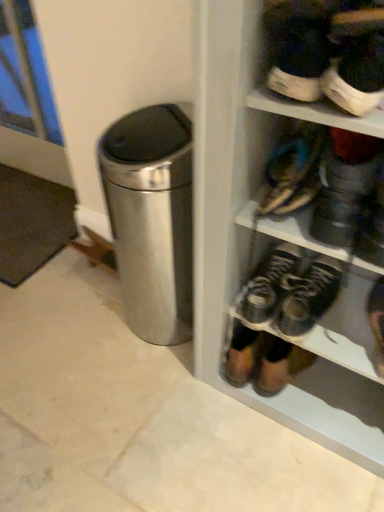
Question: Is leather sandals at upper right, which ranks as the third footwear in bottom-to-top order, beside leather shoe at lower right, the fourth footwear positioned from the top?

Choices:
 (A) yes
 (B) no

Answer: (B)

Question: Is leather sandals at upper right, which ranks as the third footwear in bottom-to-top order, positioned with its back to leather shoe at lower right, the fourth footwear positioned from the top?

Choices:
 (A) no
 (B) yes

Answer: (A)

Question: From the image's perspective, is leather sandals at upper right, which ranks as the third footwear in bottom-to-top order, under leather shoe at lower right, the fourth footwear positioned from the top?

Choices:
 (A) yes
 (B) no

Answer: (B)

Question: Does leather sandals at upper right, which ranks as the third footwear in bottom-to-top order, appear on the right side of leather shoe at lower right, the first footwear ordered from the bottom?

Choices:
 (A) no
 (B) yes

Answer: (A)

Question: From the image's perspective, would you say leather sandals at upper right, which appears as the second footwear when viewed from the top, is positioned over leather shoe at lower right, the first footwear ordered from the bottom?

Choices:
 (A) no
 (B) yes

Answer: (B)

Question: From the image's perspective, relative to leather shoe at lower right, the fourth footwear positioned from the top, is leather sandals at upper right, which appears as the second footwear when viewed from the top, above or below?

Choices:
 (A) above
 (B) below

Answer: (A)

Question: Considering the positions of leather sandals at upper right, which appears as the second footwear when viewed from the top, and leather shoe at lower right, the fourth footwear positioned from the top, in the image, is leather sandals at upper right, which appears as the second footwear when viewed from the top, taller or shorter than leather shoe at lower right, the fourth footwear positioned from the top,?

Choices:
 (A) short
 (B) tall

Answer: (A)

Question: Considering the positions of point (284, 204) and point (370, 326), is point (284, 204) closer or farther from the camera than point (370, 326)?

Choices:
 (A) farther
 (B) closer

Answer: (B)

Question: Considering their positions, is leather sandals at upper right, which appears as the second footwear when viewed from the top, located in front of or behind leather shoe at lower right, the first footwear ordered from the bottom?

Choices:
 (A) front
 (B) behind

Answer: (A)

Question: Is leather shoe at lower right, the fourth footwear positioned from the top, in front of or behind white rubber sneaker at upper right, arranged as the 1th footwear when viewed from the top, in the image?

Choices:
 (A) front
 (B) behind

Answer: (B)

Question: Is leather shoe at lower right, the fourth footwear positioned from the top, situated inside white rubber sneaker at upper right, which ranks as the 4th footwear in bottom-to-top order, or outside?

Choices:
 (A) outside
 (B) inside

Answer: (A)

Question: From a real-world perspective, is leather shoe at lower right, the first footwear ordered from the bottom, physically located above or below white rubber sneaker at upper right, arranged as the 1th footwear when viewed from the top?

Choices:
 (A) below
 (B) above

Answer: (A)

Question: In terms of size, does leather shoe at lower right, the fourth footwear positioned from the top, appear bigger or smaller than white rubber sneaker at upper right, arranged as the 1th footwear when viewed from the top?

Choices:
 (A) big
 (B) small

Answer: (A)

Question: Considering the positions of dark brown leather shoes at center, the 2th footwear from the bottom, and white rubber sneaker at upper right, arranged as the 1th footwear when viewed from the top, in the image, is dark brown leather shoes at center, the 2th footwear from the bottom, bigger or smaller than white rubber sneaker at upper right, arranged as the 1th footwear when viewed from the top,?

Choices:
 (A) big
 (B) small

Answer: (A)

Question: Considering the positions of dark brown leather shoes at center, the 2th footwear from the bottom, and white rubber sneaker at upper right, which ranks as the 4th footwear in bottom-to-top order, in the image, is dark brown leather shoes at center, the 2th footwear from the bottom, taller or shorter than white rubber sneaker at upper right, which ranks as the 4th footwear in bottom-to-top order,?

Choices:
 (A) short
 (B) tall

Answer: (B)